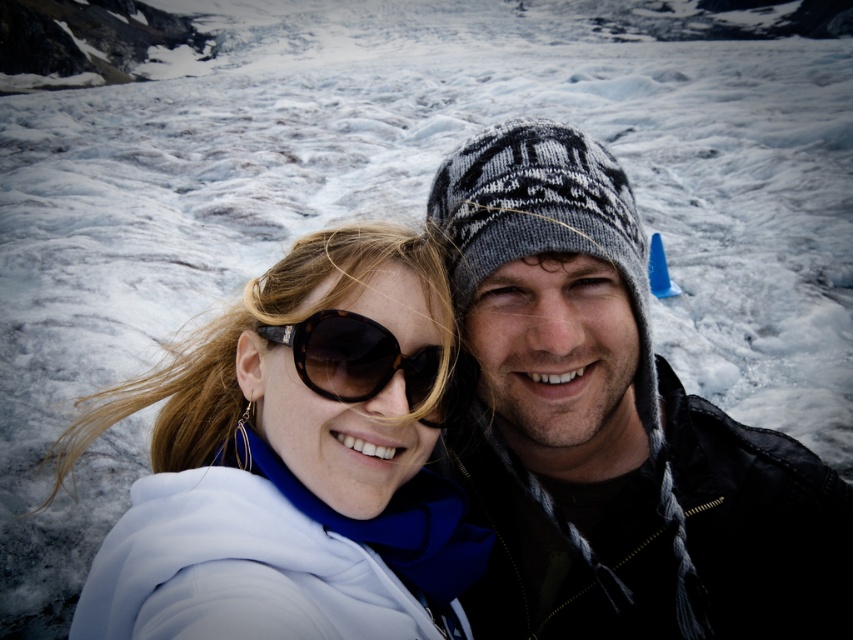
Question: Among these points, which one is nearest to the camera?

Choices:
 (A) (433, 362)
 (B) (422, 609)
 (C) (686, 429)

Answer: (A)

Question: Which object is positioned farthest from the knitted wool hat at upper right?

Choices:
 (A) black tortoiseshell sunglasses at center
 (B) white fabric at center

Answer: (B)

Question: Is white fabric at center behind black tortoiseshell sunglasses at center?

Choices:
 (A) yes
 (B) no

Answer: (B)

Question: Which of the following is the closest to the observer?

Choices:
 (A) (555, 621)
 (B) (267, 630)
 (C) (306, 358)

Answer: (B)

Question: Can you confirm if white fabric at center is positioned to the right of black tortoiseshell sunglasses at center?

Choices:
 (A) yes
 (B) no

Answer: (B)

Question: Is knitted wool hat at upper right to the right of white fabric at center from the viewer's perspective?

Choices:
 (A) yes
 (B) no

Answer: (A)